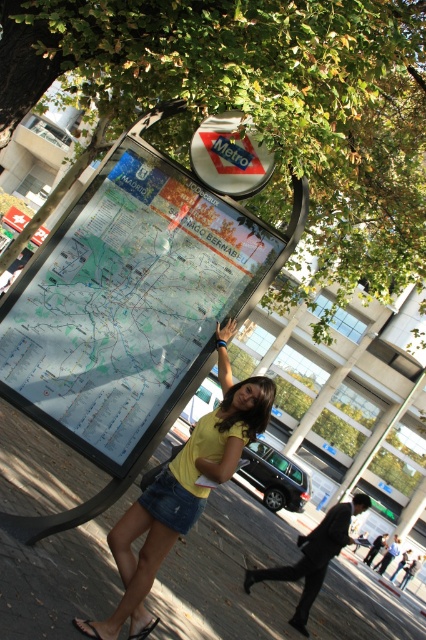
Between green leafy tree at upper center and yellow matte shirt at center, which one has more height?

Standing taller between the two is green leafy tree at upper center.

Between point (391, 140) and point (242, 442), which one is positioned in front?

Point (242, 442) is in front.

Where is `green leafy tree at upper center`? green leafy tree at upper center is located at coordinates (259, 106).

Who is shorter, transparent glass map at center or yellow matte shirt at center?

yellow matte shirt at center is shorter.

Between transparent glass map at center and yellow matte shirt at center, which one is positioned higher?

transparent glass map at center is higher up.

What are the coordinates of `transparent glass map at center` in the screenshot? It's located at (126, 305).

Locate an element on the screen. Image resolution: width=426 pixels, height=640 pixels. transparent glass map at center is located at coordinates (126, 305).

This screenshot has height=640, width=426. Identify the location of transparent glass map at center. (126, 305).

Image resolution: width=426 pixels, height=640 pixels. Identify the location of transparent glass map at center. (126, 305).